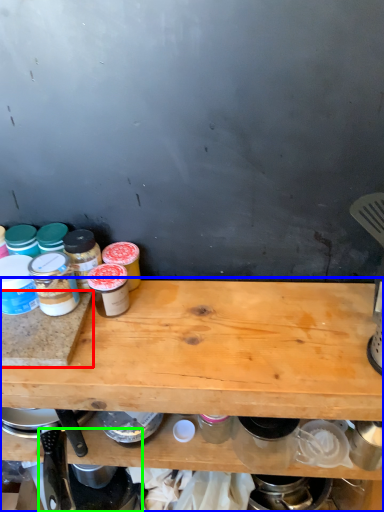
Question: Which object is positioned farthest from cutting board (highlighted by a red box)? Select from table (highlighted by a blue box) and appliance (highlighted by a green box).

Choices:
 (A) table
 (B) appliance

Answer: (B)